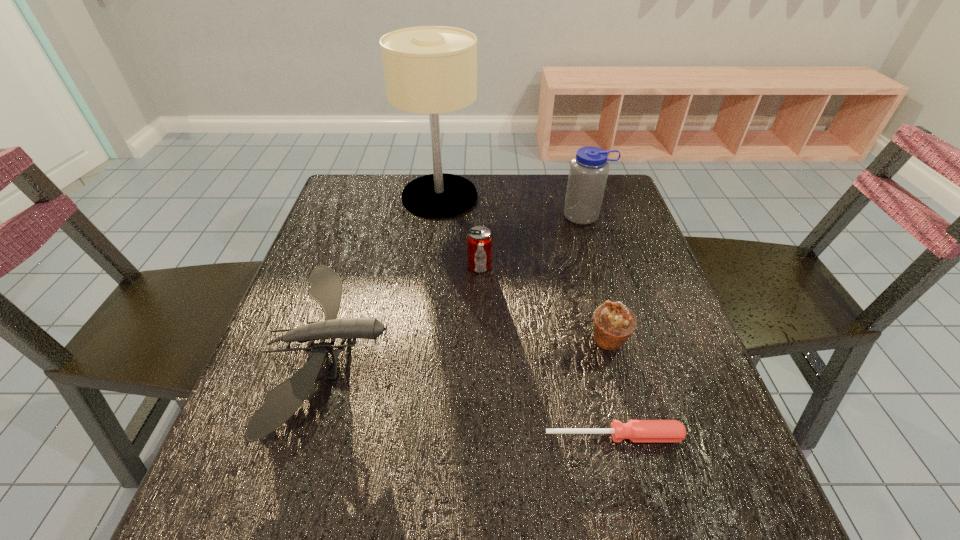
This screenshot has width=960, height=540. Identify the location of vacant region at the near edge of the desktop. (520, 496).

In the image, there is a desktop. At what (x,y) coordinates should I click in order to perform the action: click on free space at the left edge. Please return your answer as a coordinate pair (x, y). Looking at the image, I should click on (310, 258).

Where is `free space at the right edge of the desktop`? This screenshot has height=540, width=960. free space at the right edge of the desktop is located at coordinates (672, 336).

The image size is (960, 540). In the image, there is a desktop. Find the location of `free space at the far right corner`. free space at the far right corner is located at coordinates (607, 190).

Find the location of a particular element. The height and width of the screenshot is (540, 960). vacant point located between the shortest object and the muffin is located at coordinates (612, 388).

I want to click on free space between the muffin and the pop soda, so click(x=544, y=303).

This screenshot has height=540, width=960. In order to click on vacant space that is in between the table lamp and the screwdriver in this screenshot , I will do `click(527, 316)`.

Where is `vacant point located between the shortest object and the table lamp`? vacant point located between the shortest object and the table lamp is located at coordinates (527, 316).

Find the location of a particular element. free space between the screwdriver and the fourth nearest object is located at coordinates (547, 351).

Locate an element on the screen. The width and height of the screenshot is (960, 540). vacant area between the tallest object and the pop soda is located at coordinates (460, 231).